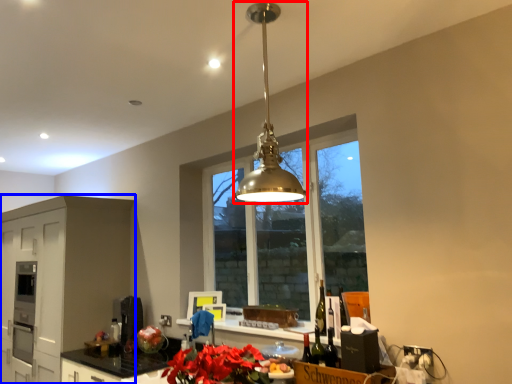
Question: Which object is further to the camera taking this photo, light fixture (highlighted by a red box) or cabinetry (highlighted by a blue box)?

Choices:
 (A) light fixture
 (B) cabinetry

Answer: (B)